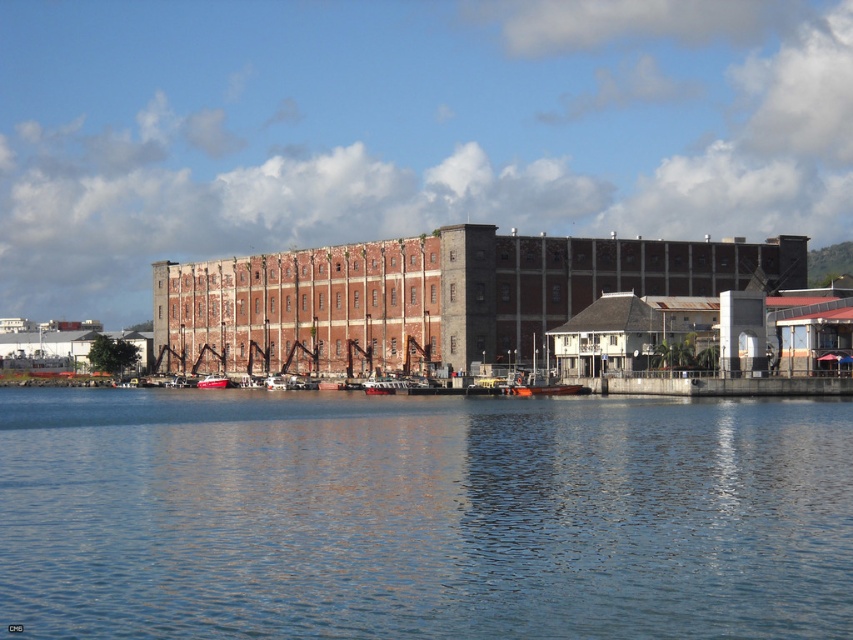
Question: Which of the following is the closest to the observer?

Choices:
 (A) metallic red boat at center
 (B) blue water at center

Answer: (B)

Question: Does blue water at center have a larger size compared to metallic red boat at center?

Choices:
 (A) yes
 (B) no

Answer: (A)

Question: In this image, where is blue water at center located relative to metallic red boat at center?

Choices:
 (A) left
 (B) right

Answer: (B)

Question: Among these points, which one is nearest to the camera?

Choices:
 (A) (212, 378)
 (B) (49, 460)

Answer: (B)

Question: Among these points, which one is nearest to the camera?

Choices:
 (A) (225, 385)
 (B) (15, 548)

Answer: (B)

Question: Does blue water at center appear on the right side of metallic red boat at center?

Choices:
 (A) no
 (B) yes

Answer: (B)